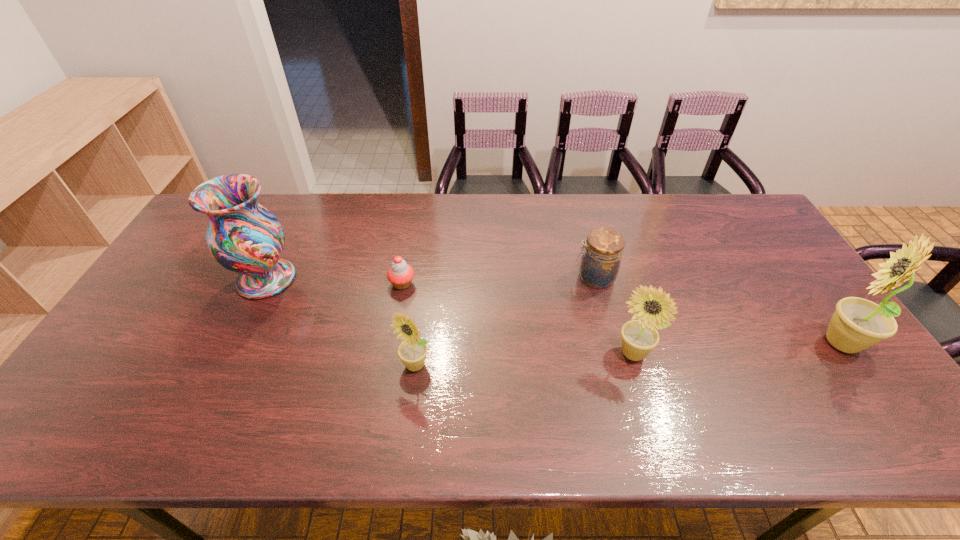
Image resolution: width=960 pixels, height=540 pixels. Find the location of `free region located 0.120m on the face of the tallest sunflower`. free region located 0.120m on the face of the tallest sunflower is located at coordinates (769, 342).

This screenshot has width=960, height=540. Identify the location of free space located on the face of the tallest sunflower. (765, 342).

This screenshot has width=960, height=540. In order to click on vacant space located 0.290m on the face of the tallest sunflower in this screenshot , I will do `click(705, 342)`.

Identify the location of free space located on the right of the shortest object. The image size is (960, 540). (510, 284).

I want to click on vacant space located 0.240m on the back of the leftmost object, so click(x=299, y=212).

Find the location of a particular element. free space located 0.160m on the lid of the jar is located at coordinates (520, 277).

At what (x,y) coordinates should I click in order to perform the action: click on free location located on the lid of the jar. Please return your answer as a coordinate pair (x, y). Image resolution: width=960 pixels, height=540 pixels. Looking at the image, I should click on (477, 277).

This screenshot has width=960, height=540. I want to click on vacant region located 0.170m on the lid of the jar, so click(x=517, y=277).

This screenshot has height=540, width=960. I want to click on object present at the near edge, so click(412, 351).

Identify the location of object that is positioned at the right edge. Image resolution: width=960 pixels, height=540 pixels. (857, 324).